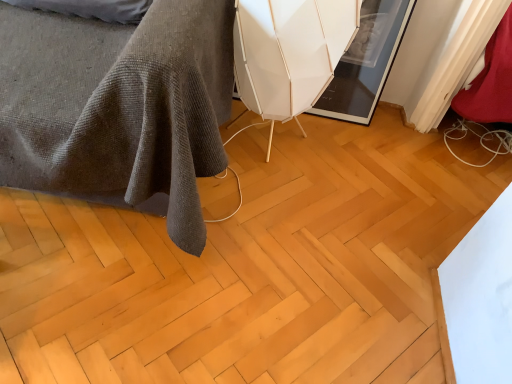
This screenshot has width=512, height=384. Identify the location of free location in front of white matte swivel chair at center. (268, 209).